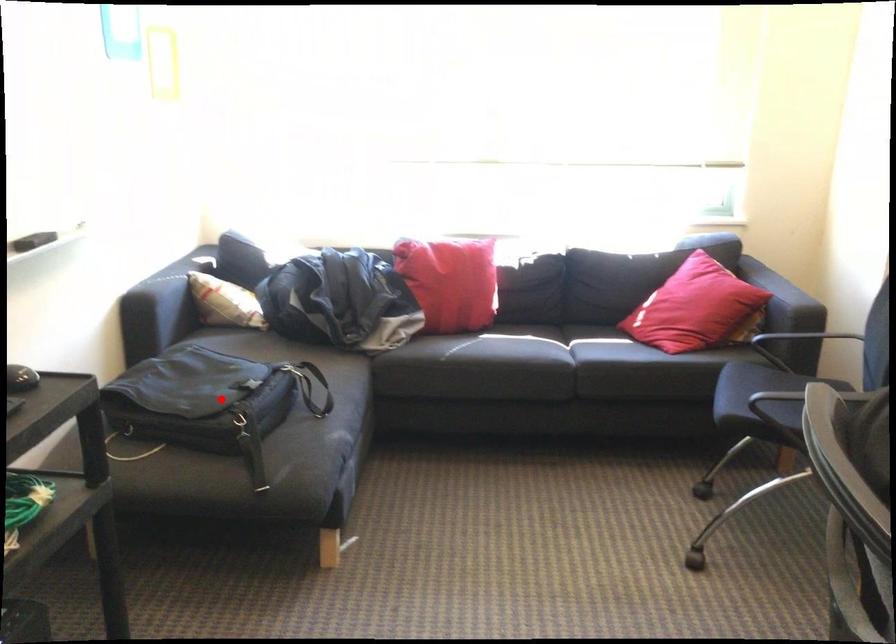
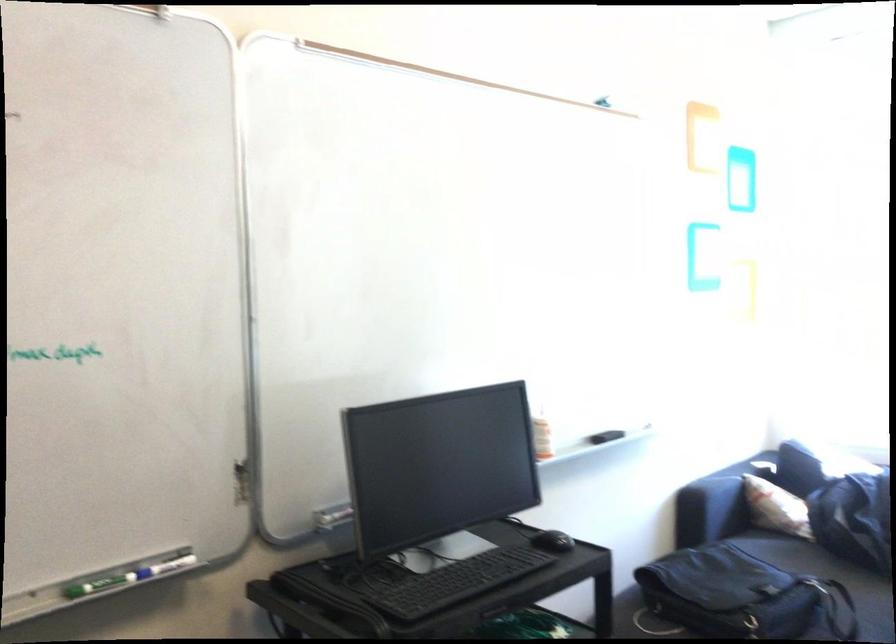
Locate, in the second image, the point that corresponds to the highlighted location in the first image.

(744, 596)